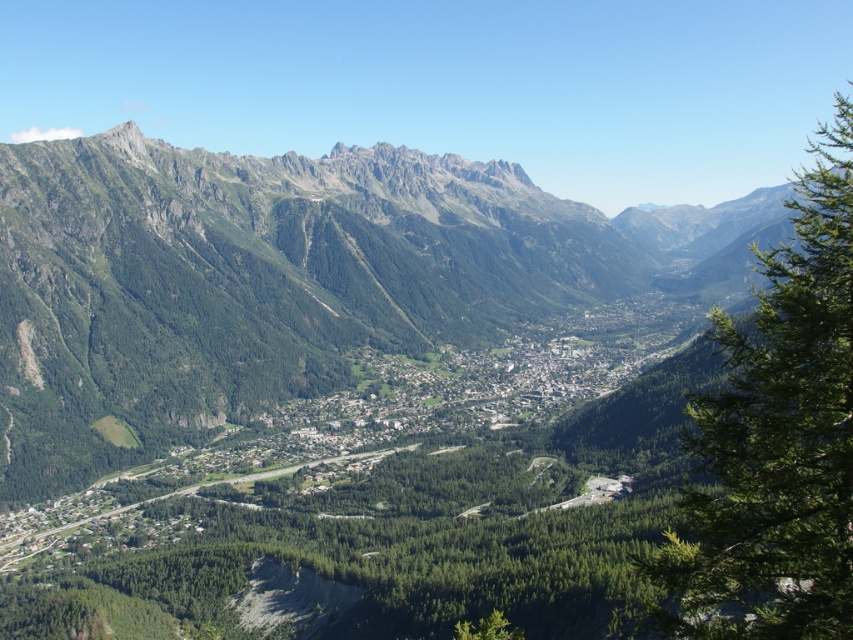
Question: Which of the following is the farthest from the observer?

Choices:
 (A) (418, 237)
 (B) (793, 632)

Answer: (A)

Question: Is green textured mountain range at center below green leafy tree at right?

Choices:
 (A) no
 (B) yes

Answer: (A)

Question: Is green textured mountain range at center smaller than green leafy tree at right?

Choices:
 (A) no
 (B) yes

Answer: (A)

Question: From the image, what is the correct spatial relationship of green textured mountain range at center in relation to green leafy tree at right?

Choices:
 (A) right
 (B) left

Answer: (B)